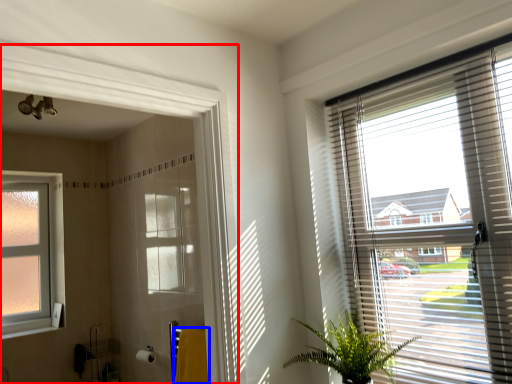
Question: Which object is closer to the camera taking this photo, screen door (highlighted by a red box) or bath towel (highlighted by a blue box)?

Choices:
 (A) screen door
 (B) bath towel

Answer: (A)